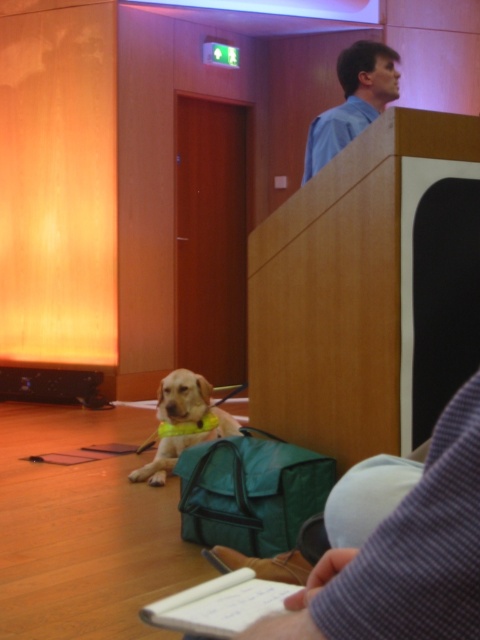
You are a service robot in the conference room. You need to move from the blue shirt at upper center to the yellow fabric dog at lower left. What is the shortest distance you need to travel?

The shortest distance between the blue shirt at upper center and the yellow fabric dog at lower left is 1.84 meters.

You are organizing a small event and need to place both the green fabric bag at lower center and the yellow fabric dog at lower left on a shelf. The shelf has a width of 1 meter. Can both items fit side by side without overlapping?

The green fabric bag at lower center might be wider than yellow fabric dog at lower left, so it is uncertain if both items can fit side by side on the 1 meter shelf without overlapping. Measure their widths to confirm.